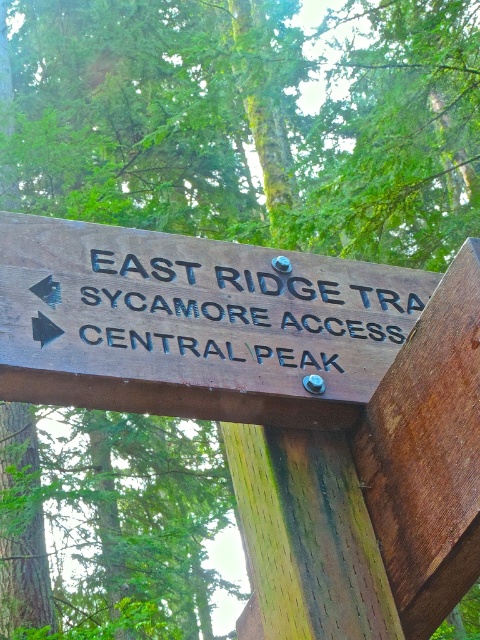
Question: Which object is closer to the camera taking this photo?

Choices:
 (A) brown wooden sign at center
 (B) black wood sign at center

Answer: (A)

Question: In this image, where is brown wooden sign at center located relative to black wood sign at center?

Choices:
 (A) above
 (B) below

Answer: (B)

Question: Which object appears farthest from the camera in this image?

Choices:
 (A) black wood sign at center
 (B) brown wooden sign at center

Answer: (A)

Question: Does brown wooden sign at center have a smaller size compared to black wood sign at center?

Choices:
 (A) no
 (B) yes

Answer: (A)

Question: Can you confirm if brown wooden sign at center is smaller than black wood sign at center?

Choices:
 (A) no
 (B) yes

Answer: (A)

Question: Among these points, which one is farthest from the camera?

Choices:
 (A) (403, 310)
 (B) (96, 257)

Answer: (A)